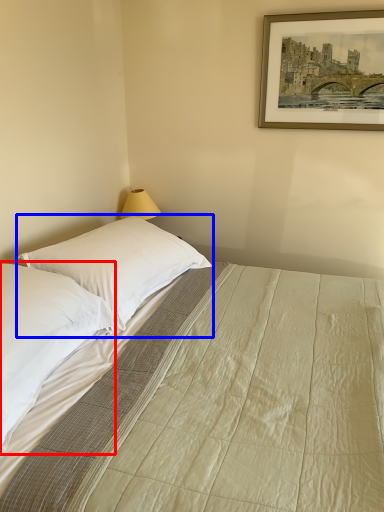
Question: Among these objects, which one is farthest to the camera, pillow (highlighted by a red box) or pillow (highlighted by a blue box)?

Choices:
 (A) pillow
 (B) pillow

Answer: (B)